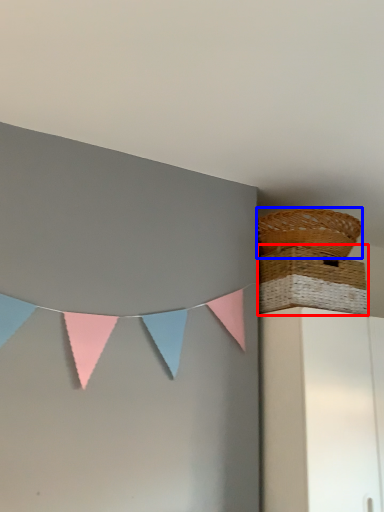
Question: Which of the following is the farthest to the observer, picnic basket (highlighted by a red box) or picnic basket (highlighted by a blue box)?

Choices:
 (A) picnic basket
 (B) picnic basket

Answer: (B)